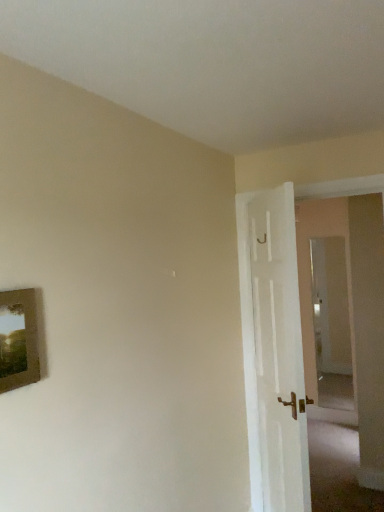
Question: Is white wooden door at right in front of or behind transparent glass door at right in the image?

Choices:
 (A) front
 (B) behind

Answer: (A)

Question: In terms of width, does white wooden door at right look wider or thinner when compared to transparent glass door at right?

Choices:
 (A) thin
 (B) wide

Answer: (B)

Question: Which is farther from the wooden picture frame at left?

Choices:
 (A) white wooden door at right
 (B) transparent glass door at right

Answer: (B)

Question: Estimate the real-world distances between objects in this image. Which object is farther from the transparent glass door at right?

Choices:
 (A) white wooden door at right
 (B) wooden picture frame at left

Answer: (B)